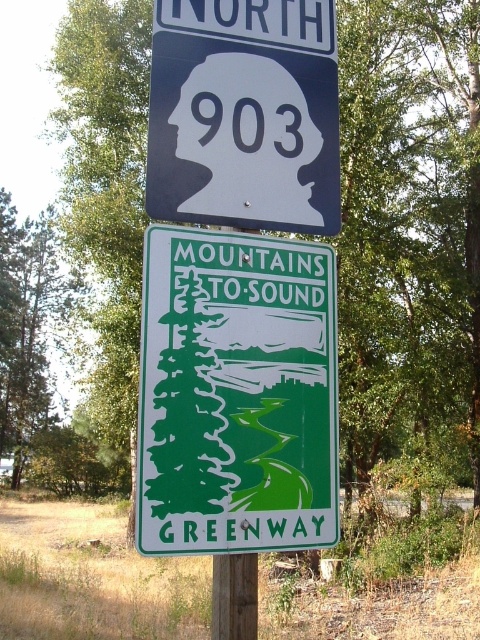
You are driving and see the two road signs on a wooden post. The green matte sign at center and the matte blue sign at upper center. Which one is positioned higher on the post?

The matte blue sign at upper center is positioned higher on the post than the green matte sign at center.

You are standing in front of two road signs on a wooden post. You notice two points marked on the signs. The first point is at coordinates point (218, 474) and the second point is at point (204, 168). Which point is closer to you?

Point (218, 474) is closer to the viewer than point (204, 168).